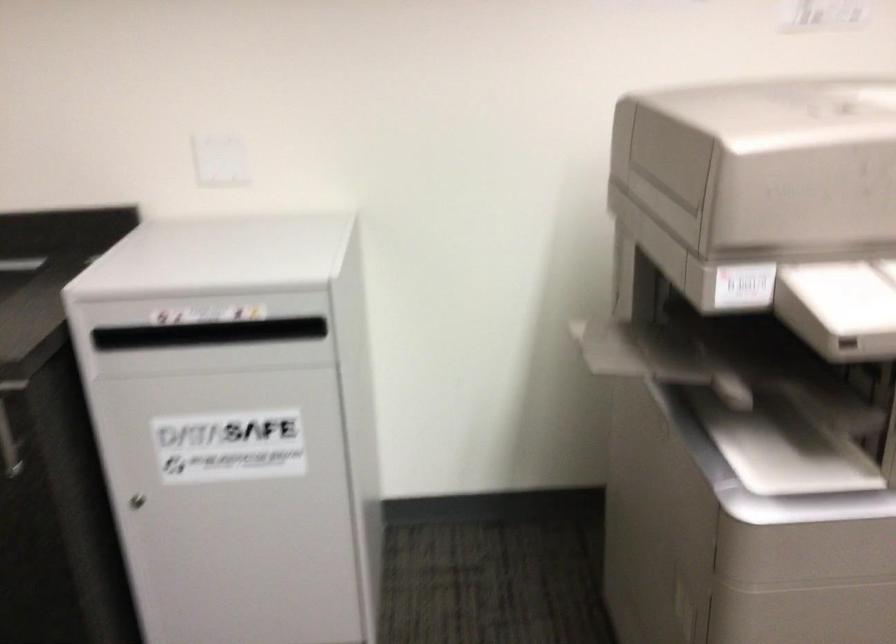
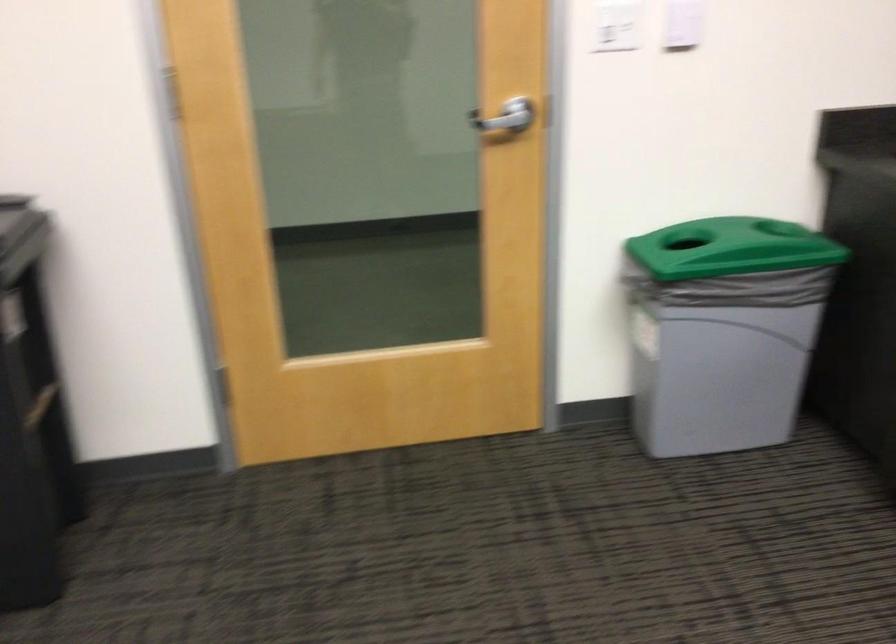
How did the camera likely rotate?

The camera's rotation is toward right-down.